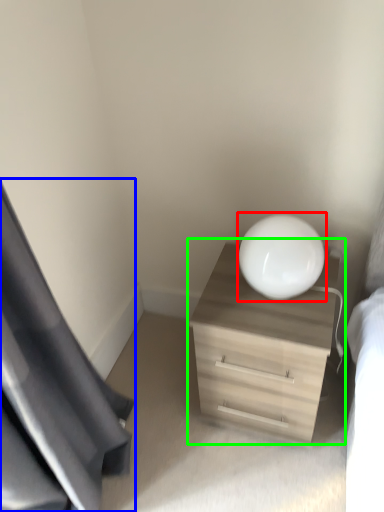
Question: Which object is the farthest from round table (highlighted by a red box)? Choose among these: curtain (highlighted by a blue box) or dresser (highlighted by a green box).

Choices:
 (A) curtain
 (B) dresser

Answer: (A)